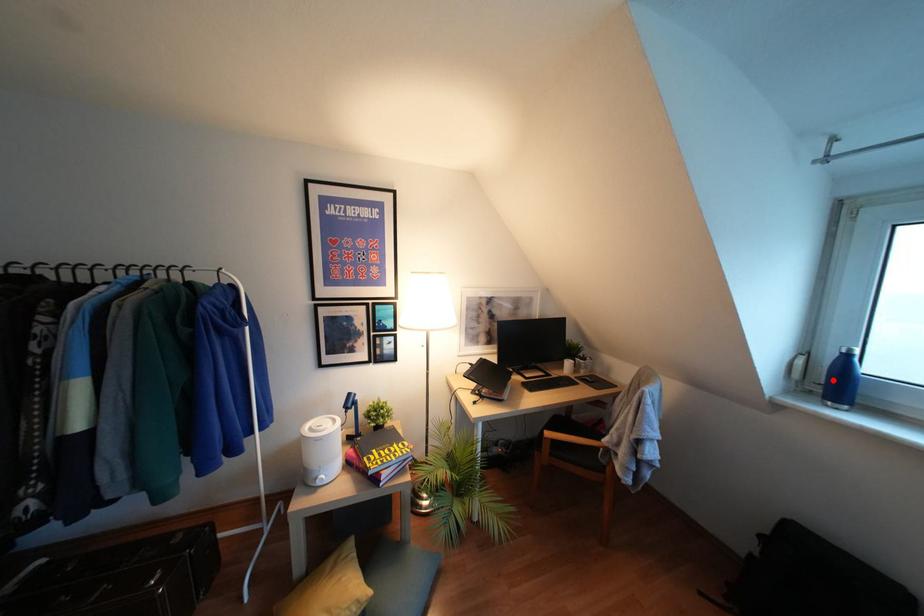
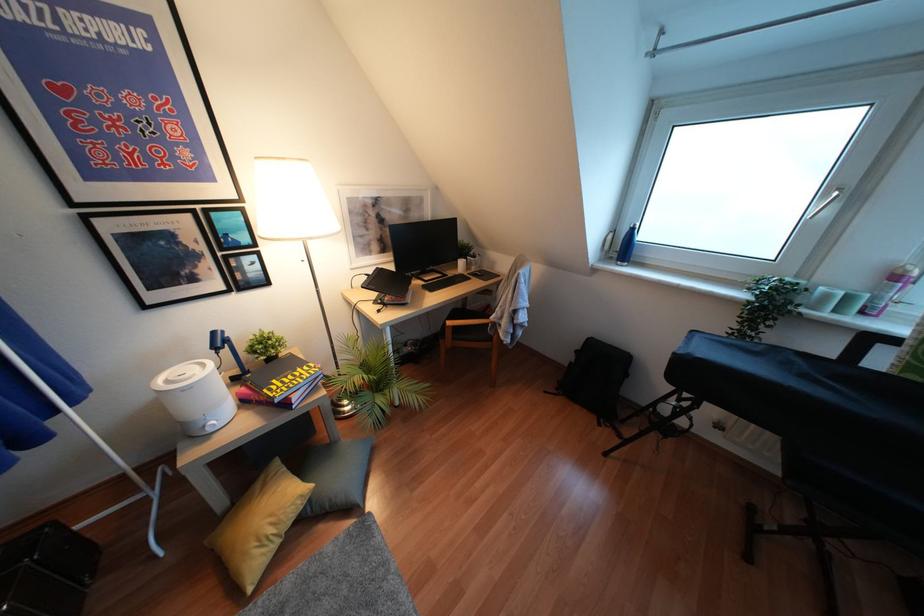
In the second image, find the point that corresponds to the highlighted location in the first image.

(623, 246)